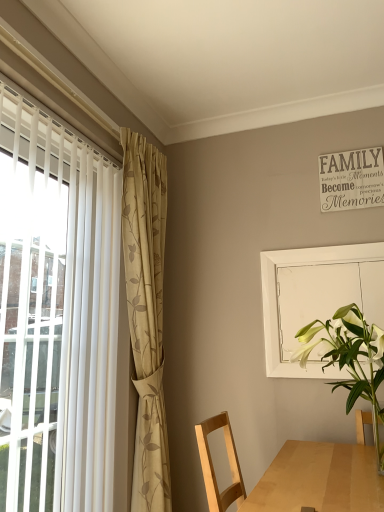
The height and width of the screenshot is (512, 384). What do you see at coordinates (350, 359) in the screenshot?
I see `white glossy vase at lower right` at bounding box center [350, 359].

The image size is (384, 512). Identify the location of beige floral fabric curtain at left. (146, 314).

The image size is (384, 512). In order to click on white glossy vase at lower right in this screenshot , I will do `click(350, 359)`.

Considering the relative positions of beige floral fabric curtain at left and white matte screen door at upper right in the image provided, is beige floral fabric curtain at left to the left of white matte screen door at upper right from the viewer's perspective?

Correct, you'll find beige floral fabric curtain at left to the left of white matte screen door at upper right.

Is beige floral fabric curtain at left thinner than white matte screen door at upper right?

In fact, beige floral fabric curtain at left might be wider than white matte screen door at upper right.

Considering the sizes of objects beige floral fabric curtain at left and white matte screen door at upper right in the image provided, who is taller, beige floral fabric curtain at left or white matte screen door at upper right?

Standing taller between the two is beige floral fabric curtain at left.

From a real-world perspective, who is located lower, beige floral fabric curtain at left or white matte screen door at upper right?

beige floral fabric curtain at left, from a real-world perspective.

From the image's perspective, is white matte screen door at upper right positioned above or below beige floral fabric curtain at left?

From the image's perspective, white matte screen door at upper right appears above beige floral fabric curtain at left.

Considering the relative sizes of white matte screen door at upper right and beige floral fabric curtain at left in the image provided, is white matte screen door at upper right smaller than beige floral fabric curtain at left?

Correct, white matte screen door at upper right occupies less space than beige floral fabric curtain at left.

Is white matte screen door at upper right beside beige floral fabric curtain at left?

white matte screen door at upper right is not next to beige floral fabric curtain at left, and they're not touching.

Would you say white matte screen door at upper right contains beige floral fabric curtain at left?

No, beige floral fabric curtain at left is not a part of white matte screen door at upper right.

The height and width of the screenshot is (512, 384). What are the coordinates of `screen door that appears on the right of white glossy vase at lower right` in the screenshot? It's located at (312, 297).

Is white glossy vase at lower right looking in the opposite direction of white matte screen door at upper right?

Yes, white glossy vase at lower right is positioned with its back facing white matte screen door at upper right.

From a real-world perspective, is white glossy vase at lower right beneath white matte screen door at upper right?

Yes, from a real-world perspective, white glossy vase at lower right is beneath white matte screen door at upper right.

Is white glossy vase at lower right not inside white matte screen door at upper right?

white glossy vase at lower right is positioned outside white matte screen door at upper right.

Is beige floral fabric curtain at left positioned with its back to white glossy vase at lower right?

beige floral fabric curtain at left does not have its back to white glossy vase at lower right.

From the picture: Considering the sizes of beige floral fabric curtain at left and white glossy vase at lower right in the image, is beige floral fabric curtain at left bigger or smaller than white glossy vase at lower right?

Clearly, beige floral fabric curtain at left is larger in size than white glossy vase at lower right.

In the image, is beige floral fabric curtain at left positioned in front of or behind white glossy vase at lower right?

beige floral fabric curtain at left is positioned farther from the viewer than white glossy vase at lower right.

Does point (153, 419) lie in front of point (371, 348)?

No, (153, 419) is behind (371, 348).

From a real-world perspective, between white matte screen door at upper right and white glossy vase at lower right, who is vertically higher?

In real-world perspective, white matte screen door at upper right is above.

Between white matte screen door at upper right and white glossy vase at lower right, which one has less height?

Standing shorter between the two is white glossy vase at lower right.

Considering the positions of objects white matte screen door at upper right and white glossy vase at lower right in the image provided, who is more to the left, white matte screen door at upper right or white glossy vase at lower right?

white glossy vase at lower right is more to the left.

Is white matte screen door at upper right not near white glossy vase at lower right?

No, white matte screen door at upper right is not far from white glossy vase at lower right.

Between white glossy vase at lower right and beige floral fabric curtain at left, which one has less height?

white glossy vase at lower right.

Can you confirm if white glossy vase at lower right is positioned to the left of beige floral fabric curtain at left?

Incorrect, white glossy vase at lower right is not on the left side of beige floral fabric curtain at left.

Is white glossy vase at lower right positioned far away from beige floral fabric curtain at left?

That's not correct — white glossy vase at lower right is a little close to beige floral fabric curtain at left.

From a real-world perspective, between white glossy vase at lower right and beige floral fabric curtain at left, who is vertically higher?

From a 3D spatial view, beige floral fabric curtain at left is above.

In the image, there is a beige floral fabric curtain at left. What are the coordinates of `screen door above it (from the image's perspective)` in the screenshot? It's located at (312, 297).

Where is `screen door above the beige floral fabric curtain at left (from a real-world perspective)`? Image resolution: width=384 pixels, height=512 pixels. screen door above the beige floral fabric curtain at left (from a real-world perspective) is located at coordinates (312, 297).

Which object lies further to the anchor point white glossy vase at lower right, beige floral fabric curtain at left or white matte screen door at upper right?

The object further to white glossy vase at lower right is beige floral fabric curtain at left.

When comparing their distances from white glossy vase at lower right, does white matte screen door at upper right or beige floral fabric curtain at left seem closer?

Based on the image, white matte screen door at upper right appears to be nearer to white glossy vase at lower right.

Which object lies further to the anchor point white matte screen door at upper right, beige floral fabric curtain at left or white glossy vase at lower right?

beige floral fabric curtain at left lies further to white matte screen door at upper right than the other object.

Which object lies further to the anchor point beige floral fabric curtain at left, white glossy vase at lower right or white matte screen door at upper right?

white glossy vase at lower right lies further to beige floral fabric curtain at left than the other object.

Based on their spatial positions, is white matte screen door at upper right or white glossy vase at lower right closer to beige floral fabric curtain at left?

Based on the image, white matte screen door at upper right appears to be nearer to beige floral fabric curtain at left.

Based on the photo, from the image, which object appears to be nearer to white matte screen door at upper right, white glossy vase at lower right or beige floral fabric curtain at left?

Based on the image, white glossy vase at lower right appears to be nearer to white matte screen door at upper right.

You are a GUI agent. You are given a task and a screenshot of the screen. Output one action in this format:
    pyautogui.click(x=<x>, y=<y>)
    Task: Click on the houseplant between beige floral fabric curtain at left and white matte screen door at upper right in the horizontal direction
    
    Given the screenshot: What is the action you would take?
    pyautogui.click(x=350, y=359)